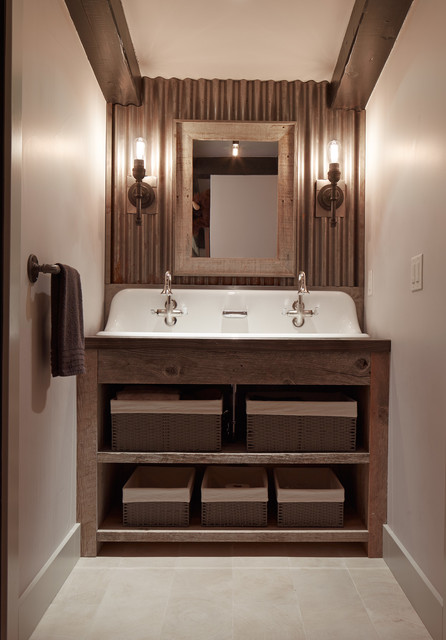
Find the location of a particular element. The width and height of the screenshot is (446, 640). light switch is located at coordinates (416, 272).